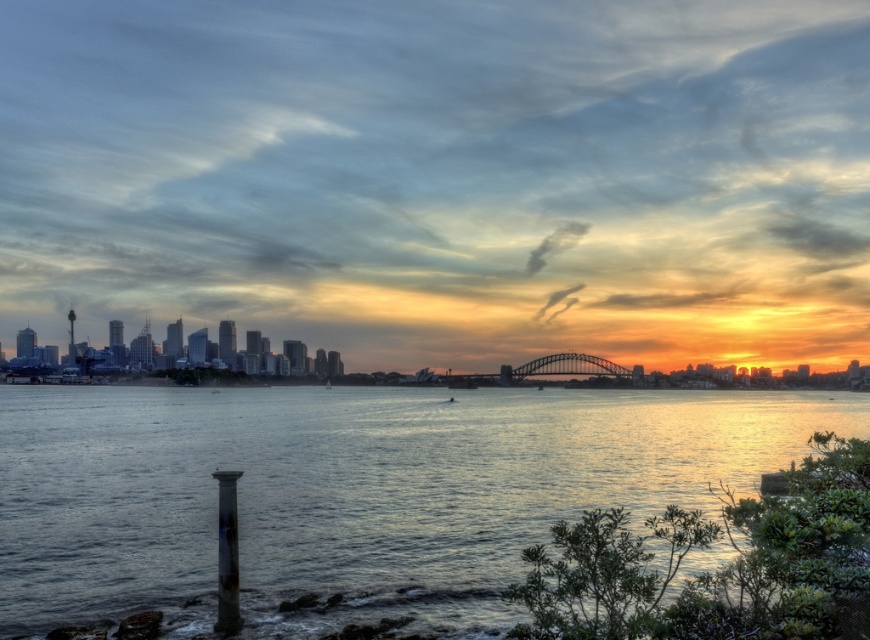
Who is positioned more to the left, smooth water at center or metallic steel bridge at center?

From the viewer's perspective, smooth water at center appears more on the left side.

Between smooth water at center and metallic steel bridge at center, which one is positioned lower?

smooth water at center

Between point (298, 620) and point (620, 369), which one is positioned behind?

The point (620, 369) is behind.

The width and height of the screenshot is (870, 640). I want to click on smooth water at center, so click(351, 492).